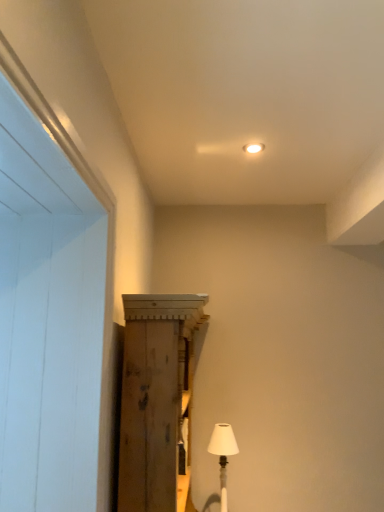
Describe the element at coordinates (157, 401) in the screenshot. This screenshot has height=512, width=384. I see `wooden cabinet at center` at that location.

In order to face wooden cabinet at center, should I rotate leftwards or rightwards?

You should rotate right by 0.676 degrees.

Locate an element on the screen. The image size is (384, 512). wooden cabinet at center is located at coordinates (157, 401).

This screenshot has height=512, width=384. What do you see at coordinates (223, 455) in the screenshot?
I see `white fabric lampshade at lower right` at bounding box center [223, 455].

At what (x,y) coordinates should I click in order to perform the action: click on white fabric lampshade at lower right. Please return your answer as a coordinate pair (x, y). Looking at the image, I should click on (223, 455).

Locate an element on the screen. This screenshot has height=512, width=384. wooden cabinet at center is located at coordinates (157, 401).

Visually, is white fabric lampshade at lower right positioned to the left or to the right of wooden cabinet at center?

white fabric lampshade at lower right is to the right of wooden cabinet at center.

Is the position of white fabric lampshade at lower right less distant than that of wooden cabinet at center?

No, it is not.

Does point (214, 441) appear closer or farther from the camera than point (147, 305)?

Clearly, point (214, 441) is more distant from the camera than point (147, 305).

From the image's perspective, does white fabric lampshade at lower right appear lower than wooden cabinet at center?

Yes.

From a real-world perspective, is white fabric lampshade at lower right positioned over wooden cabinet at center based on gravity?

No, from a real-world perspective, white fabric lampshade at lower right is not above wooden cabinet at center.

Which of these two, white fabric lampshade at lower right or wooden cabinet at center, is wider?

Wider between the two is wooden cabinet at center.

Who is shorter, white fabric lampshade at lower right or wooden cabinet at center?

white fabric lampshade at lower right is shorter.

Which of these two, white fabric lampshade at lower right or wooden cabinet at center, is bigger?

wooden cabinet at center.

Looking at this image, choose the correct answer: Is white fabric lampshade at lower right inside wooden cabinet at center or outside it?

white fabric lampshade at lower right is located inside wooden cabinet at center.

Does white fabric lampshade at lower right touch wooden cabinet at center?

No, white fabric lampshade at lower right is not with wooden cabinet at center.

Is white fabric lampshade at lower right facing towards wooden cabinet at center?

Yes, white fabric lampshade at lower right is facing wooden cabinet at center.

Where is `cabinetry above the white fabric lampshade at lower right (from a real-world perspective)`? Image resolution: width=384 pixels, height=512 pixels. cabinetry above the white fabric lampshade at lower right (from a real-world perspective) is located at coordinates (157, 401).

Visually, is wooden cabinet at center positioned to the left or to the right of white fabric lampshade at lower right?

wooden cabinet at center is positioned on white fabric lampshade at lower right's left side.

Consider the image. Does wooden cabinet at center come behind white fabric lampshade at lower right?

No, it is in front of white fabric lampshade at lower right.

Is point (181, 313) closer or farther from the camera than point (223, 485)?

Point (181, 313) is positioned closer to the camera compared to point (223, 485).

From the image's perspective, is wooden cabinet at center positioned above or below white fabric lampshade at lower right?

wooden cabinet at center is above white fabric lampshade at lower right.

From a real-world perspective, who is located lower, wooden cabinet at center or white fabric lampshade at lower right?

In real-world perspective, white fabric lampshade at lower right is lower.

Between wooden cabinet at center and white fabric lampshade at lower right, which one has smaller width?

white fabric lampshade at lower right is thinner.

Can you confirm if wooden cabinet at center is shorter than white fabric lampshade at lower right?

No.

Considering the sizes of wooden cabinet at center and white fabric lampshade at lower right in the image, is wooden cabinet at center bigger or smaller than white fabric lampshade at lower right?

wooden cabinet at center is bigger than white fabric lampshade at lower right.

Would you say wooden cabinet at center contains white fabric lampshade at lower right?

Yes, white fabric lampshade at lower right is a part of wooden cabinet at center.

Is wooden cabinet at center positioned far away from white fabric lampshade at lower right?

wooden cabinet at center is actually quite close to white fabric lampshade at lower right.

Consider the image. Is wooden cabinet at center aimed at white fabric lampshade at lower right?

Yes, wooden cabinet at center faces towards white fabric lampshade at lower right.

Identify the location of cabinetry that is above the white fabric lampshade at lower right (from the image's perspective). (157, 401).

You are a GUI agent. You are given a task and a screenshot of the screen. Output one action in this format:
    pyautogui.click(x=<x>, y=<y>)
    Task: Click on the cabinetry above the white fabric lampshade at lower right (from the image's perspective)
    
    Given the screenshot: What is the action you would take?
    pyautogui.click(x=157, y=401)

At what (x,y) coordinates should I click in order to perform the action: click on table lamp lying behind the wooden cabinet at center. Please return your answer as a coordinate pair (x, y). Looking at the image, I should click on (223, 455).